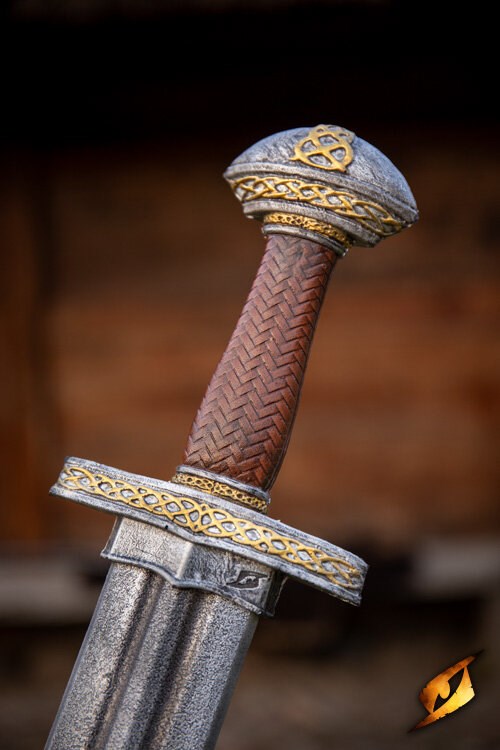
Where is `floor`? floor is located at coordinates (347, 704).